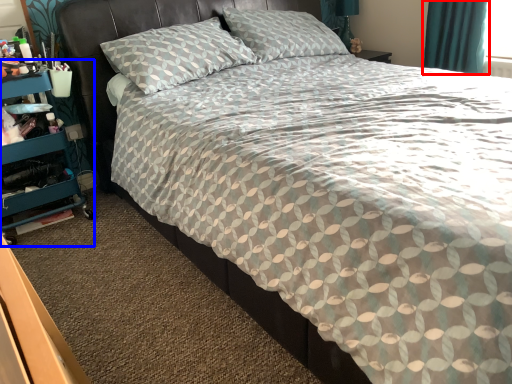
Question: Which point is closer to the camera, curtain (highlighted by a red box) or dresser (highlighted by a blue box)?

Choices:
 (A) curtain
 (B) dresser

Answer: (B)